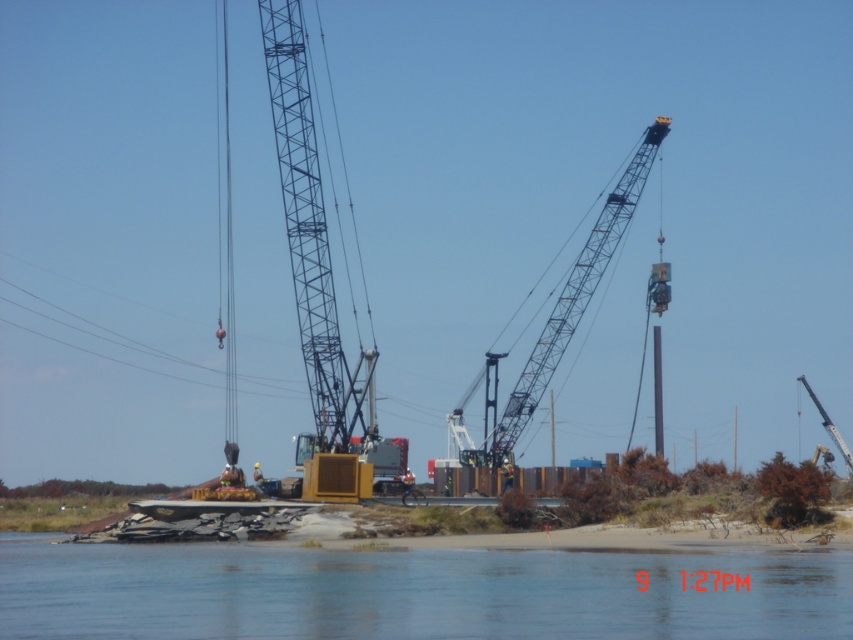
Does metallic blue crane at center have a greater height compared to metallic gray crane at right?

Correct, metallic blue crane at center is much taller as metallic gray crane at right.

Can you confirm if metallic blue crane at center is shorter than metallic gray crane at right?

Incorrect, metallic blue crane at center's height does not fall short of metallic gray crane at right's.

Is point (299, 268) farther from camera compared to point (808, 392)?

No, (299, 268) is closer to viewer.

Find the location of a particular element. The width and height of the screenshot is (853, 640). metallic blue crane at center is located at coordinates (310, 234).

This screenshot has height=640, width=853. Find the location of `metallic gray crane at upper right`. metallic gray crane at upper right is located at coordinates (569, 305).

Can you confirm if metallic gray crane at upper right is positioned below metallic gray crane at right?

Incorrect, metallic gray crane at upper right is not positioned below metallic gray crane at right.

Locate an element on the screen. The image size is (853, 640). metallic gray crane at upper right is located at coordinates (569, 305).

Can you confirm if clear water at lower center is shorter than metallic blue crane at center?

Yes, clear water at lower center is shorter than metallic blue crane at center.

Can you confirm if clear water at lower center is thinner than metallic blue crane at center?

A: No.

Does point (463, 605) come farther from viewer compared to point (363, 422)?

No, (463, 605) is in front of (363, 422).

The width and height of the screenshot is (853, 640). In order to click on clear water at lower center in this screenshot , I will do `click(410, 593)`.